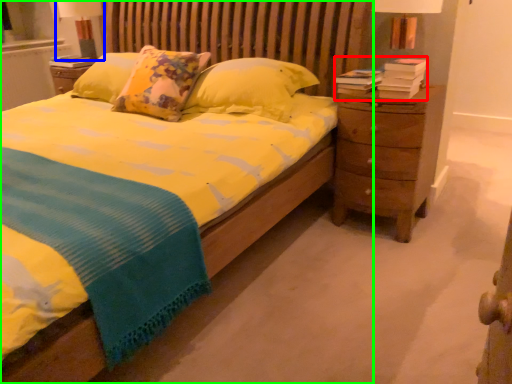
Question: Which object is positioned farthest from book (highlighted by a red box)? Select from bedside lamp (highlighted by a blue box) and bed (highlighted by a green box).

Choices:
 (A) bedside lamp
 (B) bed

Answer: (A)